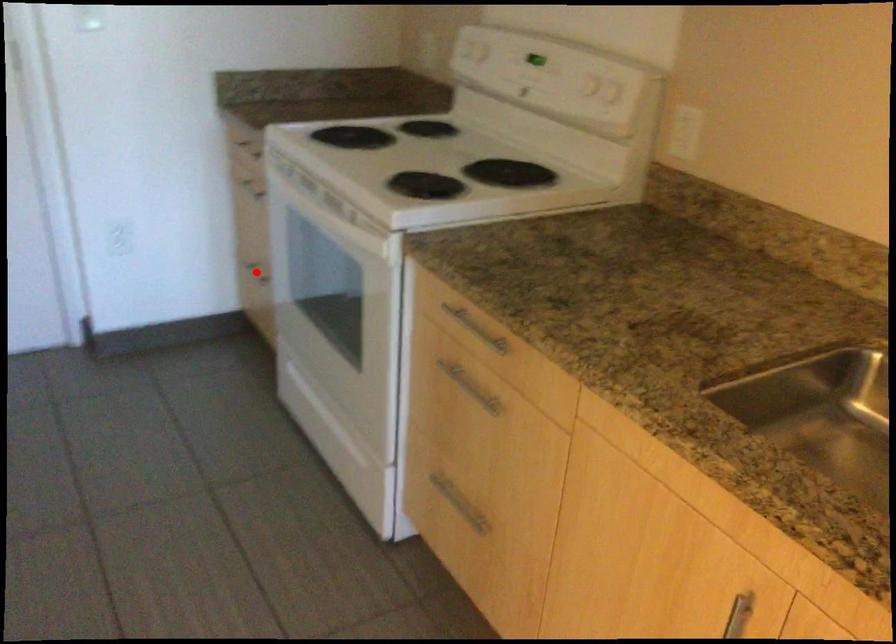
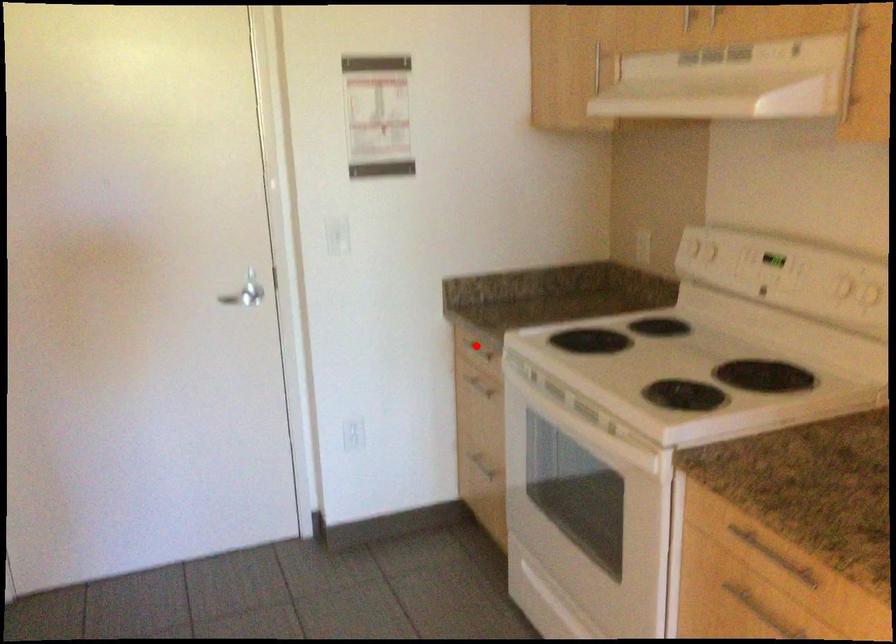
I am providing you with two images of the same scene from different viewpoints. A red point is marked on the first image and another point is marked on the second image. Is the red point in image1 aligned with the point shown in image2?

No